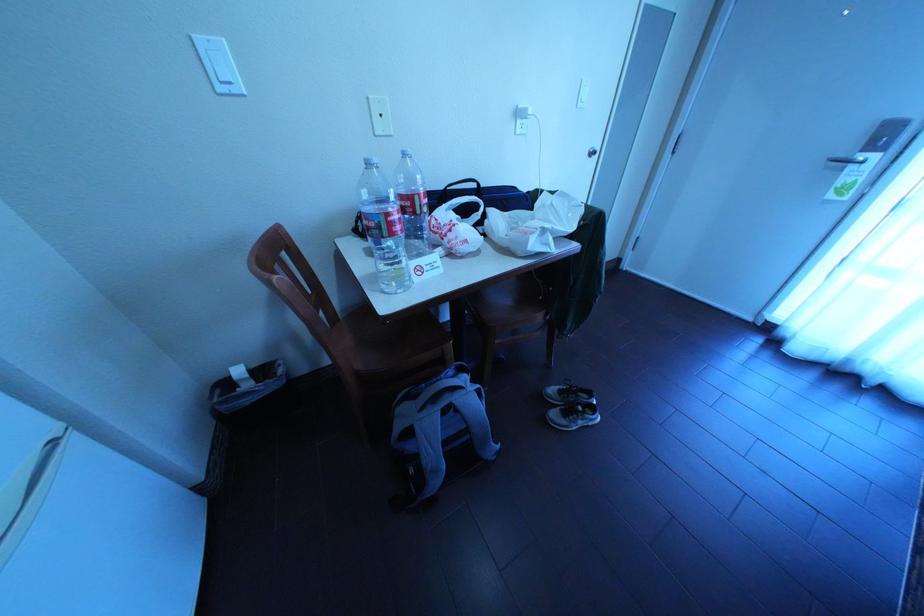
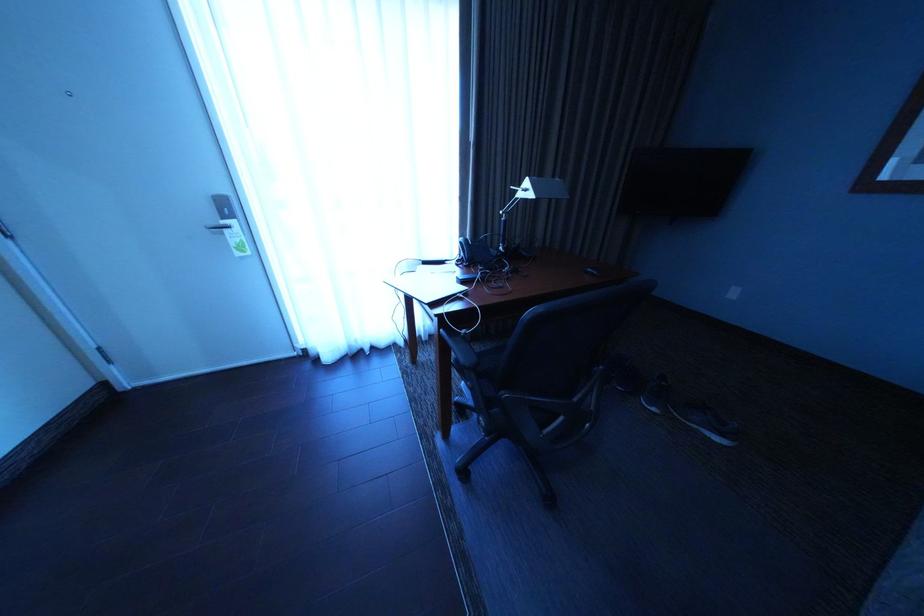
Based on the continuous images, in which direction is the camera rotating?

The rotation direction of the camera is right-down.